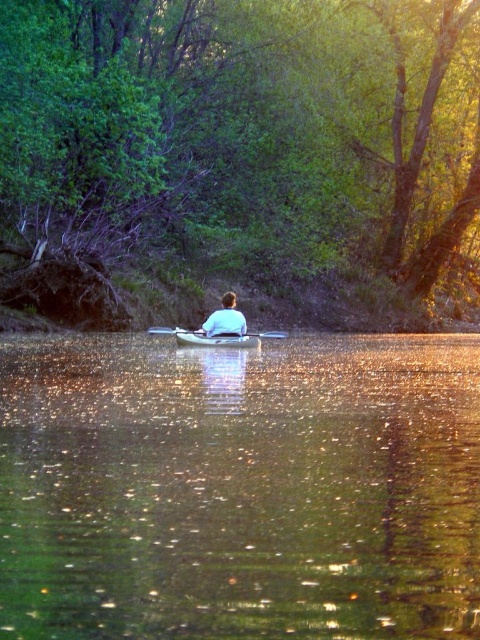
You are standing on the bank of the waterway and want to take a photo of both the green reflective water at center and the green leafy tree at center. Which object will appear smaller in the photo?

The green reflective water at center will appear smaller in the photo because it has a smaller size compared to the green leafy tree at center.

You are a photographer planning to capture the kayaker in the scene. You want to ensure the kayak remains centered in the frame while avoiding any obstructions from the tree. Given the green reflective water at center and the green leafy tree at center, which object should you focus on to keep the kayak visible?

The green reflective water at center has a lesser width compared to the green leafy tree at center, so focusing on the green reflective water at center will help keep the kayak visible as it is narrower and less likely to block the view.

You are standing at the edge of the water and want to reach the point marked at coordinates point (4, 52). If your maximum walking distance on land is 20 meters, can you reach it without getting into the water?

The point marked at coordinates point (4, 52) is 23.77 meters away from you, which exceeds your 20 meters walking limit. Therefore, you cannot reach it without getting into the water.